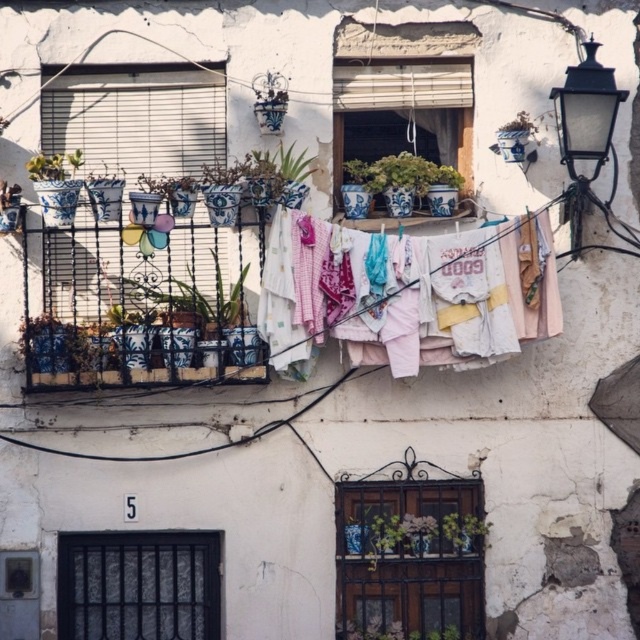
Is blue and white ceramic pots at left to the right of blue and white ceramic pot at center from the viewer's perspective?

In fact, blue and white ceramic pots at left is to the left of blue and white ceramic pot at center.

Can you confirm if blue and white ceramic pots at left is shorter than blue and white ceramic pot at center?

Incorrect, blue and white ceramic pots at left's height does not fall short of blue and white ceramic pot at center's.

Who is more forward, [74,376] or [403,193]?

Point [74,376] is in front.

This screenshot has width=640, height=640. What are the coordinates of `blue and white ceramic pots at left` in the screenshot? It's located at (259, 308).

Who is positioned more to the right, green glossy plant at lower center or green ceramic pot at upper right?

green ceramic pot at upper right is more to the right.

At what (x,y) coordinates should I click in order to perform the action: click on green glossy plant at lower center. Please return your answer as a coordinate pair (x, y). The height and width of the screenshot is (640, 640). Looking at the image, I should click on (461, 531).

Is blue and white ceramic pots at left positioned behind black metal streetlamp at upper right?

That is True.

Who is more forward, [173,230] or [582,196]?

Positioned in front is point [582,196].

At what (x,y) coordinates should I click in order to perform the action: click on blue and white ceramic pots at left. Please return your answer as a coordinate pair (x, y). Looking at the image, I should click on (259, 308).